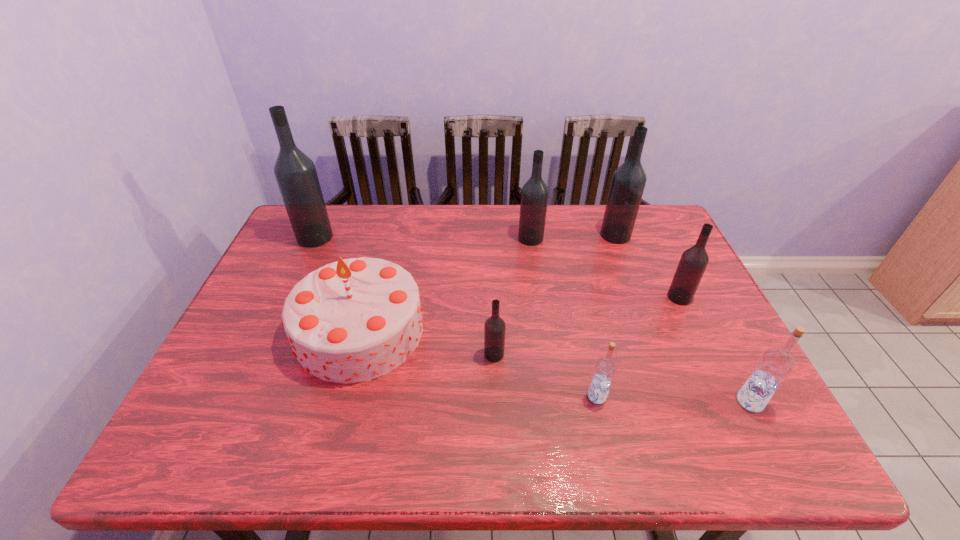
Where is `the nearest black vodka`? The height and width of the screenshot is (540, 960). the nearest black vodka is located at coordinates (494, 329).

At what (x,y) coordinates should I click in order to perform the action: click on the second black vodka from left to right. Please return your answer as a coordinate pair (x, y). The image size is (960, 540). Looking at the image, I should click on (494, 329).

Where is `the left blue vodka`? The image size is (960, 540). the left blue vodka is located at coordinates (605, 368).

Find the location of a particular element. This screenshot has width=960, height=540. the fourth object from right to left is located at coordinates (605, 368).

Identify the location of free location located on the right of the leftmost vodka. The image size is (960, 540). (453, 237).

The width and height of the screenshot is (960, 540). What are the coordinates of `vacant space located 0.270m on the front of the sixth object from left to right` in the screenshot? It's located at (642, 306).

What are the coordinates of `blank space located on the back of the third smallest black vodka` in the screenshot? It's located at (528, 220).

At what (x,y) coordinates should I click in order to perform the action: click on vacant space located 0.080m on the right of the birthday cake. Please return your answer as a coordinate pair (x, y). This screenshot has width=960, height=540. Looking at the image, I should click on (456, 330).

At what (x,y) coordinates should I click in order to perform the action: click on free region located 0.080m on the front of the fourth biggest black vodka. Please return your answer as a coordinate pair (x, y). This screenshot has width=960, height=540. Looking at the image, I should click on (694, 328).

This screenshot has width=960, height=540. In order to click on vacant region located on the left of the bigger blue vodka in this screenshot , I will do `click(678, 401)`.